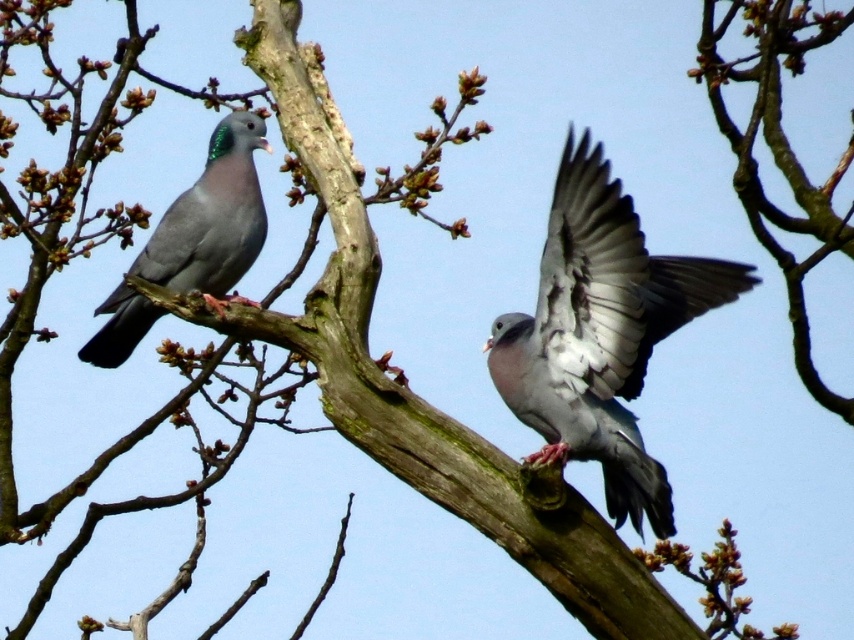
You are a birdwatcher observing two pigeons on a tree branch. You notice a gray matte pigeon at center and a matte gray pigeon at left. Which pigeon is closer to you based on their positions?

The gray matte pigeon at center is closer to you because it is positioned in front of the matte gray pigeon at left.

You are holding a camera and want to take a closeup photo of the gray matte pigeon at center. The camera requires the subject to be at least 10 feet away to avoid blurriness. Can you take the photo from your current position?

The gray matte pigeon at center and camera are 8.15 feet apart, which is less than the required 10 feet. Therefore, you cannot take the photo from your current position without risking blurriness.

You are a birdwatcher observing two points in the scene. The first point is at coordinates point [662,509] and the second is at point [110,362]. Which point is closer to you, the observer?

Point [662,509] is closer to you because it is in front of point [110,362].